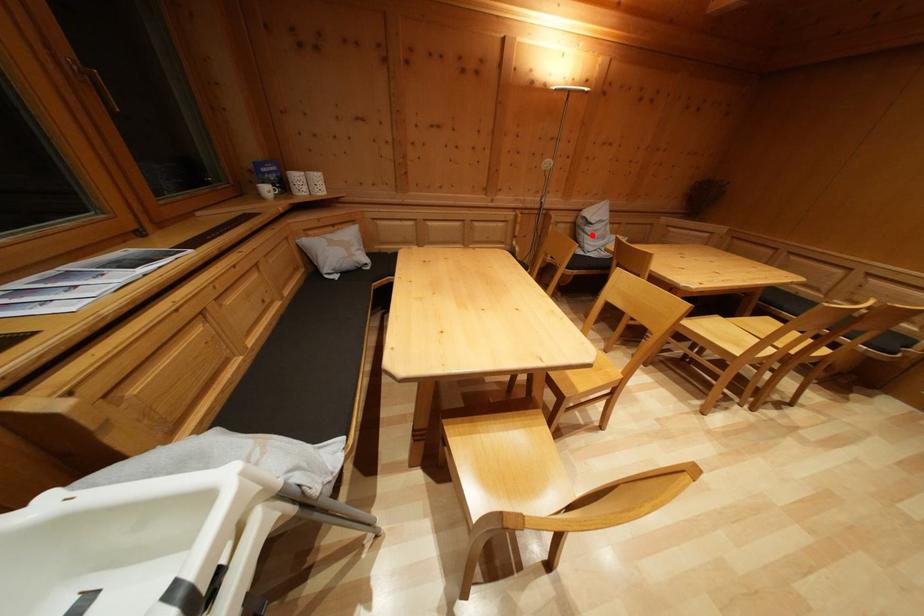
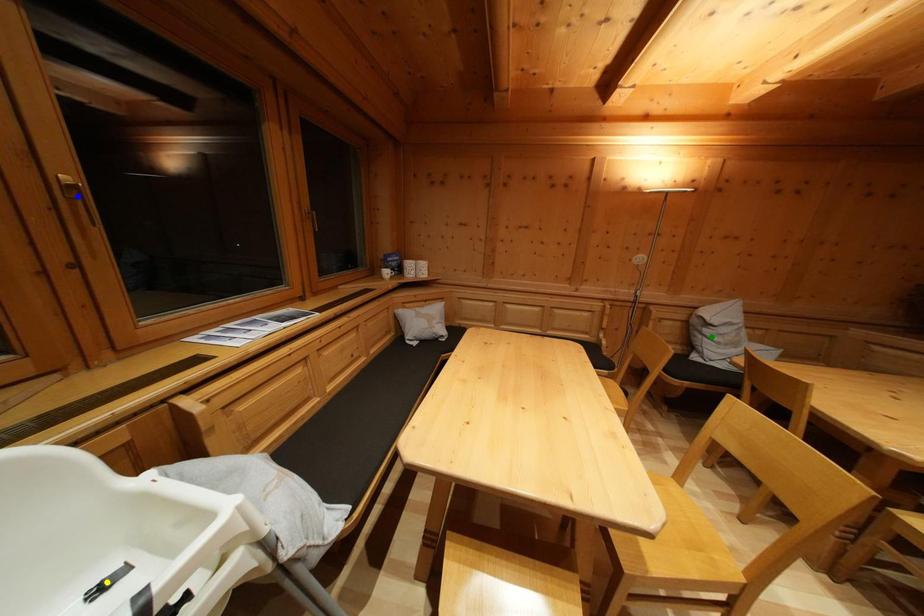
Question: I am providing you with two images of the same scene from different viewpoints. A red point is marked on the first image. You are given multiple points on the second image. Can you choose the point in image 2 that corresponds to the point in image 1?

Choices:
 (A) blue point
 (B) green point
 (C) yellow point

Answer: (B)